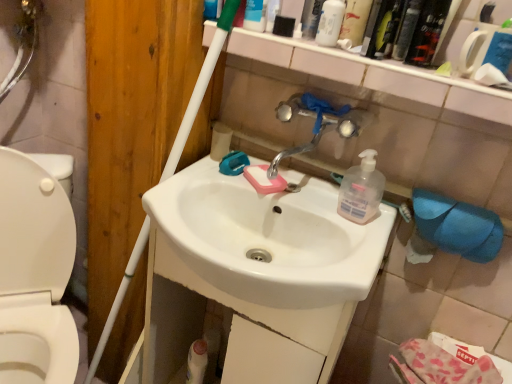
Where is `free location to the left of translucent plastic soap dispenser at center-right, acting as the second cleaning product starting from the top`? The image size is (512, 384). free location to the left of translucent plastic soap dispenser at center-right, acting as the second cleaning product starting from the top is located at coordinates (304, 201).